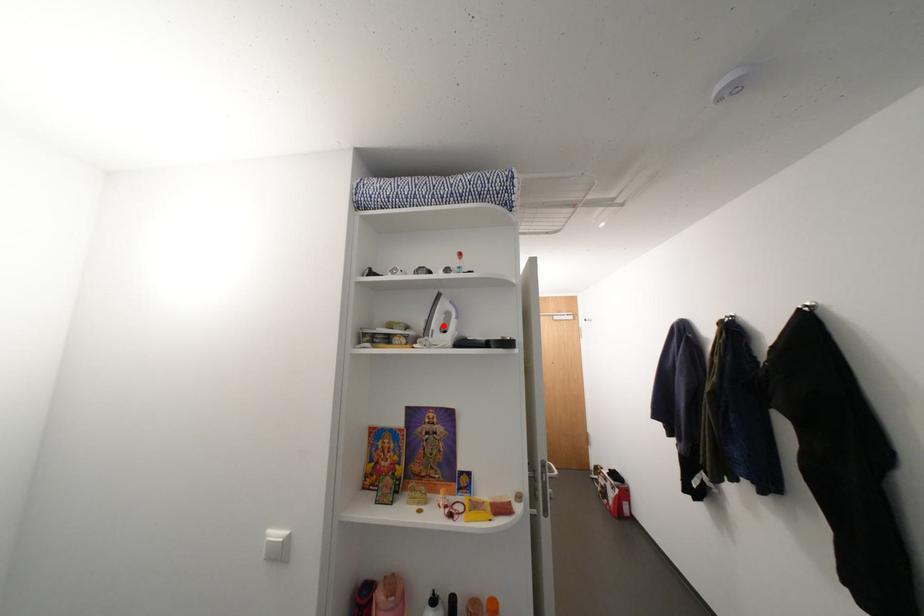
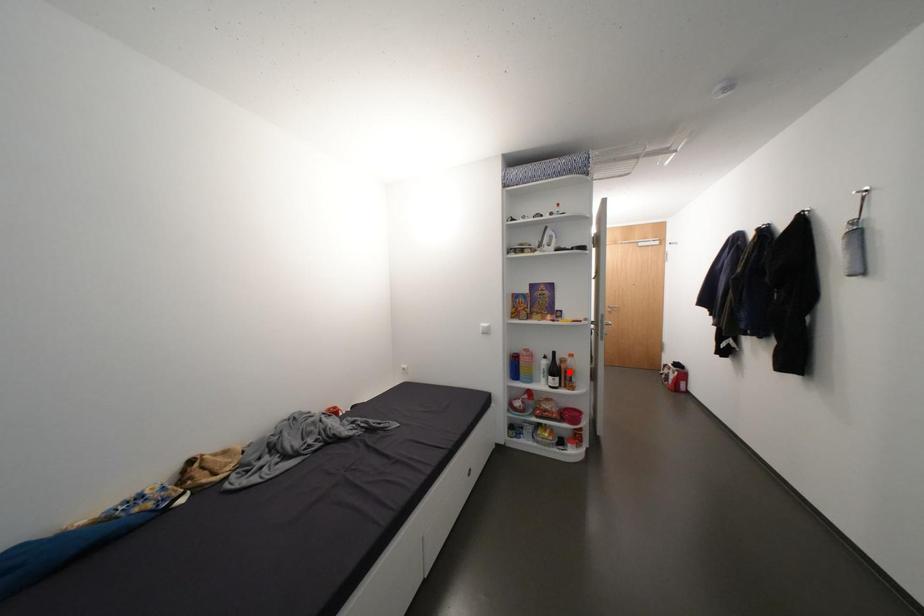
I am providing you with two images of the same scene from different viewpoints. A red point is marked on the first image and another point is marked on the second image. Does the point marked in image1 correspond to the same location as the one in image2?

No